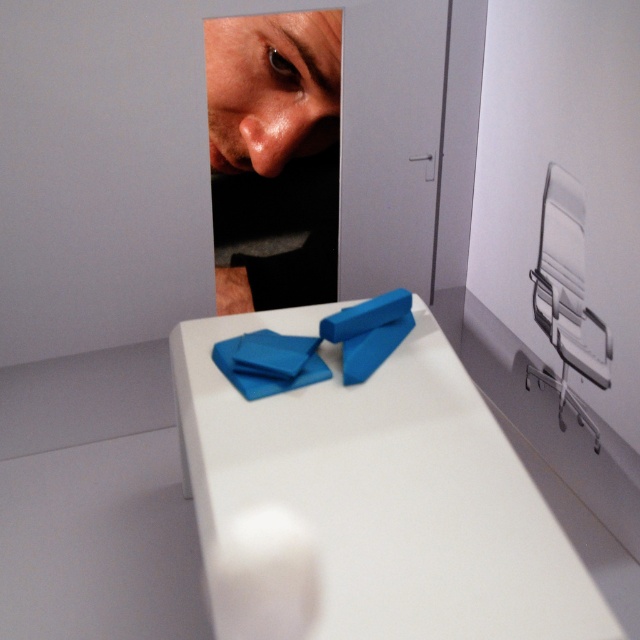
Question: Observing the image, what is the correct spatial positioning of white glossy table at center in reference to matte skin at center?

Choices:
 (A) left
 (B) right

Answer: (B)

Question: Does white glossy table at center have a smaller size compared to matte skin at center?

Choices:
 (A) yes
 (B) no

Answer: (B)

Question: Which of the following is the closest to the observer?

Choices:
 (A) white glossy table at center
 (B) matte skin at center

Answer: (A)

Question: Is white glossy table at center thinner than matte skin at center?

Choices:
 (A) no
 (B) yes

Answer: (A)